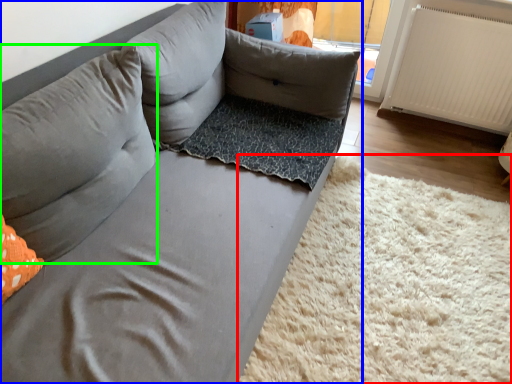
Question: Which object is positioned farthest from mat (highlighted by a red box)? Select from studio couch (highlighted by a blue box) and pillow (highlighted by a green box).

Choices:
 (A) studio couch
 (B) pillow

Answer: (B)